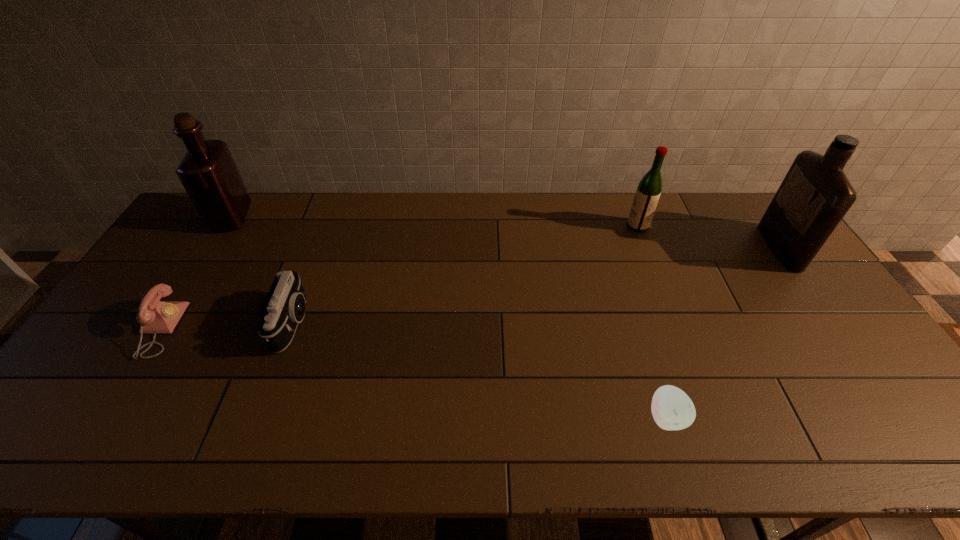
This screenshot has width=960, height=540. Find the location of `vacant space located on the label side of the rightmost liquor`. vacant space located on the label side of the rightmost liquor is located at coordinates (723, 247).

At what (x,y) coordinates should I click in order to perform the action: click on free space located on the label side of the rightmost liquor. Please return your answer as a coordinate pair (x, y). Looking at the image, I should click on (689, 247).

The width and height of the screenshot is (960, 540). What are the coordinates of `blank space located 0.330m on the front of the leftmost liquor` in the screenshot? It's located at (173, 312).

Find the location of `free spot located 0.370m on the label of the second liquor from right to left`. free spot located 0.370m on the label of the second liquor from right to left is located at coordinates (520, 226).

I want to click on free space located on the label of the second liquor from right to left, so click(x=529, y=226).

The image size is (960, 540). Find the location of `free space located 0.170m on the label of the second liquor from right to left`. free space located 0.170m on the label of the second liquor from right to left is located at coordinates (578, 226).

Where is `free space located on the front lens of the fourth object from right to left`? This screenshot has width=960, height=540. free space located on the front lens of the fourth object from right to left is located at coordinates (364, 322).

At what (x,y) coordinates should I click in order to perform the action: click on vacant space positioned on the dial of the telephone. Please return your answer as a coordinate pair (x, y). This screenshot has width=960, height=540. Looking at the image, I should click on (267, 329).

At what (x,y) coordinates should I click in order to perform the action: click on free space located 0.100m on the right of the apple. Please return your answer as a coordinate pair (x, y). Image resolution: width=960 pixels, height=540 pixels. Looking at the image, I should click on (729, 417).

Locate an element on the screen. This screenshot has height=540, width=960. object at the near edge is located at coordinates (672, 409).